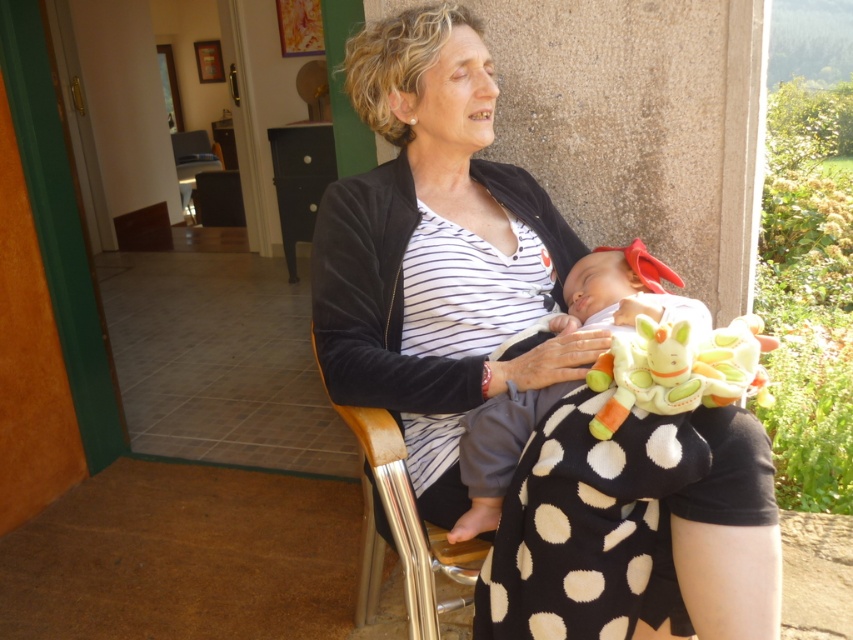
Between striped fabric shirt at center and metallic silver chair at center, which one is positioned higher?

striped fabric shirt at center is above.

At what (x,y) coordinates should I click in order to perform the action: click on striped fabric shirt at center. Please return your answer as a coordinate pair (x, y). Looking at the image, I should click on pos(424,244).

The image size is (853, 640). What do you see at coordinates (424, 244) in the screenshot?
I see `striped fabric shirt at center` at bounding box center [424, 244].

This screenshot has height=640, width=853. In order to click on striped fabric shirt at center in this screenshot , I will do `click(424, 244)`.

Consider the image. Can you confirm if metallic silver chair at center is thinner than matte black chair at center?

Yes.

Who is positioned more to the left, metallic silver chair at center or matte black chair at center?

matte black chair at center

Measure the distance between point (399,436) and camera.

They are 1.14 meters apart.

Image resolution: width=853 pixels, height=640 pixels. Find the location of `metallic silver chair at center`. metallic silver chair at center is located at coordinates (403, 531).

Is white soft baby at center smaller than fluffy plush toy at lap?

No, white soft baby at center is not smaller than fluffy plush toy at lap.

Which is below, white soft baby at center or fluffy plush toy at lap?

white soft baby at center

Does point (498, 486) come closer to viewer compared to point (601, 387)?

That is False.

Locate an element on the screen. Image resolution: width=853 pixels, height=640 pixels. white soft baby at center is located at coordinates (497, 451).